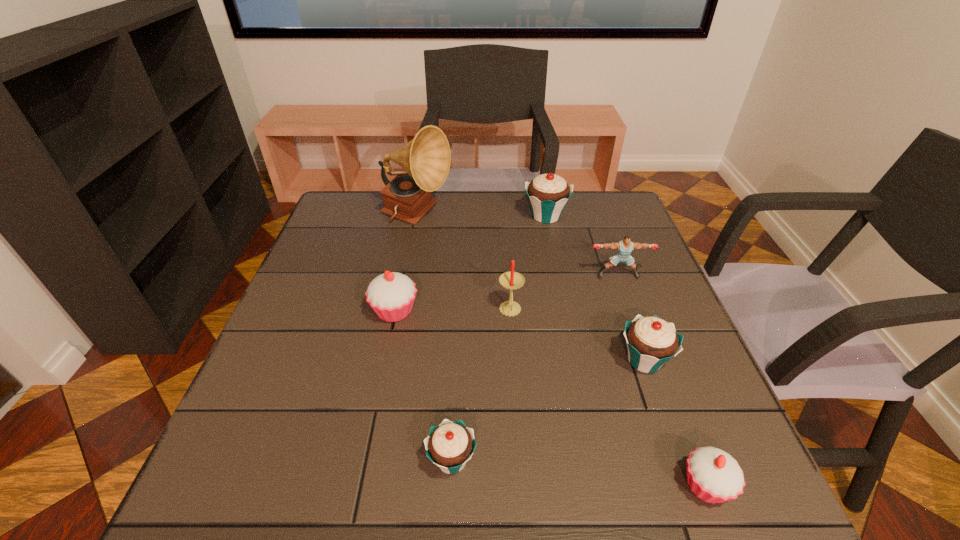
Find the location of `the fourth cupcake from right to left`. the fourth cupcake from right to left is located at coordinates (450, 445).

What are the coordinates of `the smallest teal cupcake` in the screenshot? It's located at (450, 445).

Find the location of a particular element. the smaller pink cupcake is located at coordinates (714, 476).

In order to click on the right pink cupcake in this screenshot , I will do (714, 476).

This screenshot has height=540, width=960. Identify the location of free point located on the horn of the phonograph record. (512, 217).

This screenshot has height=540, width=960. I want to click on blank area located 0.370m on the left of the third cupcake from right to left, so pyautogui.click(x=401, y=216).

Locate an element on the screen. vacant region located 0.170m on the left of the fourth object from left to right is located at coordinates (426, 311).

I want to click on free location located on the front-facing side of the puncher, so click(660, 393).

Where is `vacant space located 0.270m on the front of the bigger pink cupcake`? This screenshot has height=540, width=960. vacant space located 0.270m on the front of the bigger pink cupcake is located at coordinates (369, 441).

Find the location of a particular element. The image size is (960, 540). vacant space located on the back of the second smallest teal cupcake is located at coordinates (622, 296).